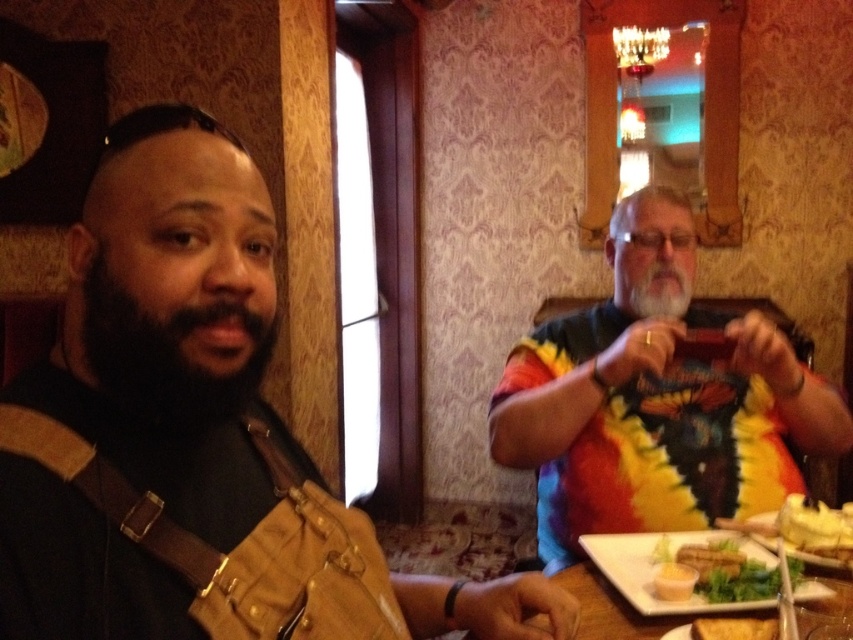
Question: Estimate the real-world distances between objects in this image. Which object is closer to the green leafy salad at lower right?

Choices:
 (A) yellow creamy cake at lower right
 (B) tie-dye shirt at right
 (C) brown leather jacket at left
 (D) white soft beard at center

Answer: (A)

Question: Does black fuzzy beard at left have a larger size compared to white ceramic plate at lower right?

Choices:
 (A) yes
 (B) no

Answer: (B)

Question: Can you confirm if black fuzzy beard at left is positioned above white soft beard at center?

Choices:
 (A) yes
 (B) no

Answer: (B)

Question: Observing the image, what is the correct spatial positioning of brown leather jacket at left in reference to black fuzzy beard at left?

Choices:
 (A) below
 (B) above

Answer: (A)

Question: Which object is positioned farthest from the white ceramic plate at lower right?

Choices:
 (A) yellow creamy sauce at lower center
 (B) green leafy salad at lower right

Answer: (A)

Question: Which object appears closest to the camera in this image?

Choices:
 (A) brown leather jacket at left
 (B) black fuzzy beard at left
 (C) green leafy salad at lower right
 (D) golden crispy bread at lower right

Answer: (A)